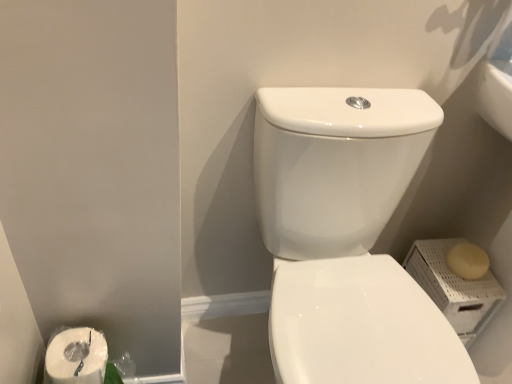
Locate an element on the screen. The height and width of the screenshot is (384, 512). white matte soap at right is located at coordinates (468, 261).

What do you see at coordinates (468, 261) in the screenshot? The width and height of the screenshot is (512, 384). I see `white matte soap at right` at bounding box center [468, 261].

Image resolution: width=512 pixels, height=384 pixels. I want to click on white glossy toilet at center, so click(346, 237).

The width and height of the screenshot is (512, 384). What do you see at coordinates (346, 237) in the screenshot?
I see `white glossy toilet at center` at bounding box center [346, 237].

Locate an element on the screen. The height and width of the screenshot is (384, 512). white matte soap at right is located at coordinates (468, 261).

Which is more to the right, white glossy toilet at center or white matte soap at right?

white matte soap at right.

Is white glossy toilet at center in front of white matte soap at right?

Yes, white glossy toilet at center is closer to the viewer.

Which is closer to the camera, (447, 341) or (452, 266)?

Point (447, 341).

From the image's perspective, which one is positioned higher, white glossy toilet at center or white matte soap at right?

white matte soap at right appears higher in the image.

From a real-world perspective, which object stands above the other?

In real-world perspective, white glossy toilet at center is above.

In terms of width, does white glossy toilet at center look wider or thinner when compared to white matte soap at right?

Clearly, white glossy toilet at center has more width compared to white matte soap at right.

Is white glossy toilet at center taller than white matte soap at right?

Correct, white glossy toilet at center is much taller as white matte soap at right.

Who is bigger, white glossy toilet at center or white matte soap at right?

Bigger between the two is white glossy toilet at center.

Is white glossy toilet at center surrounding white matte soap at right?

Definitely not — white matte soap at right is not inside white glossy toilet at center.

In the scene shown: Are white glossy toilet at center and white matte soap at right beside each other?

No, white glossy toilet at center is not beside white matte soap at right.

Could you tell me if white glossy toilet at center is turned towards white matte soap at right?

No, white glossy toilet at center is not aimed at white matte soap at right.

How different are the orientations of white glossy toilet at center and white matte soap at right in degrees?

3.19 degrees separate the facing orientations of white glossy toilet at center and white matte soap at right.

How much distance is there between white glossy toilet at center and white matte soap at right?

white glossy toilet at center is 42.60 centimeters away from white matte soap at right.

The height and width of the screenshot is (384, 512). I want to click on toilet above the white matte soap at right (from a real-world perspective), so 346,237.

Considering the relative positions of white matte soap at right and white glossy toilet at center in the image provided, is white matte soap at right to the right of white glossy toilet at center from the viewer's perspective?

Correct, you'll find white matte soap at right to the right of white glossy toilet at center.

In the image, is white matte soap at right positioned in front of or behind white glossy toilet at center?

white matte soap at right is behind white glossy toilet at center.

Is point (487, 269) less distant than point (290, 297)?

No, it is not.

From the image's perspective, does white matte soap at right appear lower than white glossy toilet at center?

Incorrect, from the image's perspective, white matte soap at right is higher than white glossy toilet at center.

From a real-world perspective, which object rests below the other?

In real-world perspective, white matte soap at right is lower.

Which of these two, white matte soap at right or white glossy toilet at center, is wider?

white glossy toilet at center.

Considering the sizes of objects white matte soap at right and white glossy toilet at center in the image provided, who is taller, white matte soap at right or white glossy toilet at center?

Standing taller between the two is white glossy toilet at center.

Does white matte soap at right have a smaller size compared to white glossy toilet at center?

Yes, white matte soap at right is smaller than white glossy toilet at center.

Do you think white matte soap at right is within white glossy toilet at center, or outside of it?

white matte soap at right cannot be found inside white glossy toilet at center.

Is white matte soap at right with white glossy toilet at center?

No, white matte soap at right is not touching white glossy toilet at center.

Is white matte soap at right turned away from white glossy toilet at center?

No, white matte soap at right is not facing away from white glossy toilet at center.

Can you tell me how much white matte soap at right and white glossy toilet at center differ in facing direction?

The angular difference between white matte soap at right and white glossy toilet at center is 3.19 degrees.

Where is `soap to the right of white glossy toilet at center`? This screenshot has width=512, height=384. soap to the right of white glossy toilet at center is located at coordinates (468, 261).

The width and height of the screenshot is (512, 384). I want to click on soap above the white glossy toilet at center (from the image's perspective), so click(x=468, y=261).

You are a GUI agent. You are given a task and a screenshot of the screen. Output one action in this format:
    pyautogui.click(x=<x>, y=<y>)
    Task: Click on the toilet in front of the white matte soap at right
    This screenshot has height=384, width=512.
    Given the screenshot: What is the action you would take?
    pyautogui.click(x=346, y=237)